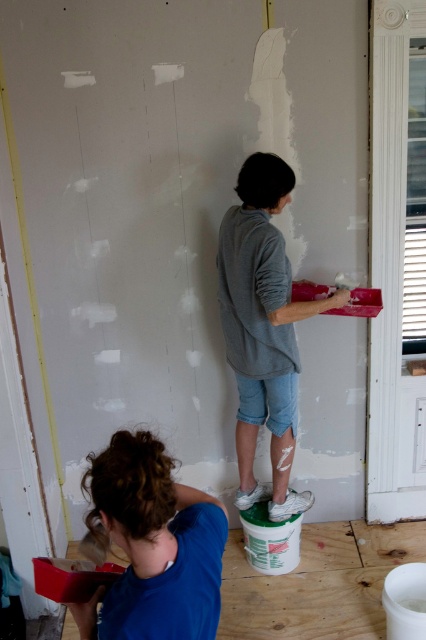
Can you confirm if blue fabric shirt at lower left is positioned below gray cotton shirt at center?

Indeed, blue fabric shirt at lower left is positioned under gray cotton shirt at center.

Can you confirm if blue fabric shirt at lower left is positioned to the right of gray cotton shirt at center?

Incorrect, blue fabric shirt at lower left is not on the right side of gray cotton shirt at center.

Is point (209, 509) less distant than point (245, 397)?

That is True.

Locate an element on the screen. The width and height of the screenshot is (426, 640). blue fabric shirt at lower left is located at coordinates (154, 545).